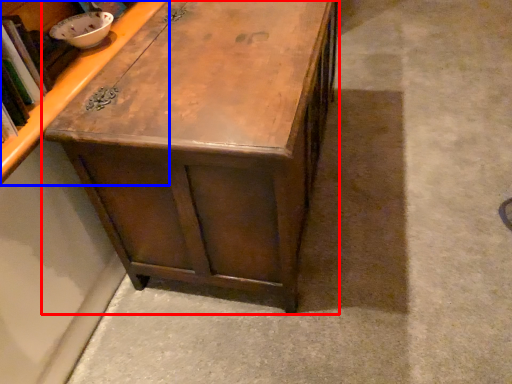
Question: Which point is closer to the camera, table (highlighted by a red box) or cabinetry (highlighted by a blue box)?

Choices:
 (A) table
 (B) cabinetry

Answer: (B)